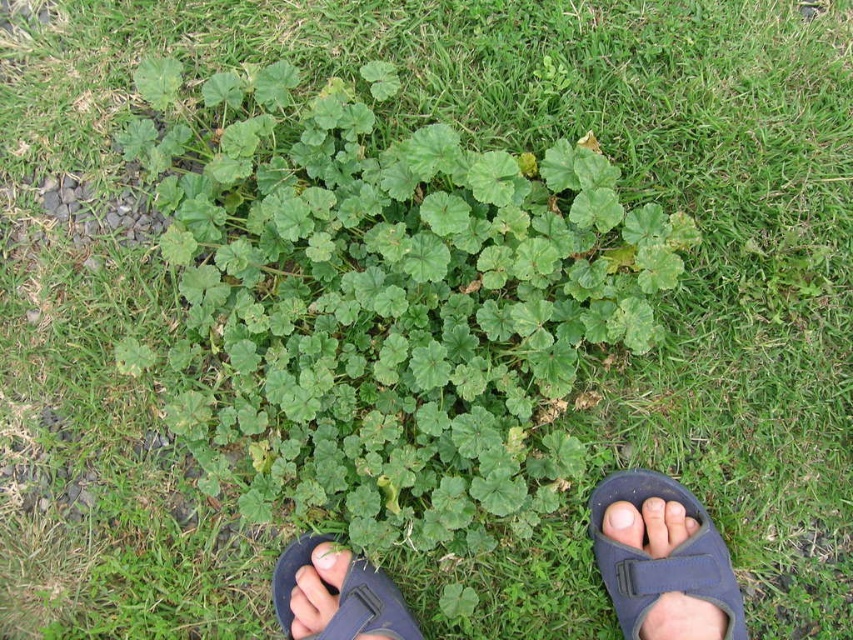
You are standing in a garden and want to take a closer look at the plant. If you move forward 0.5 meters, will the point at point (282, 612) become closer than 1 meter to you?

The distance of point (282, 612) from camera is 1.56 meters. Moving forward 0.5 meters would reduce the distance to 1.06 meters, which is still more than 1 meter away. So the point at point (282, 612) will not become closer than 1 meter to you.

You are standing in a garden and see the black fabric sandal at lower center and the pink flesh at center. Which object is nearer to you?

The black fabric sandal at lower center is closer to the viewer than the pink flesh at center.